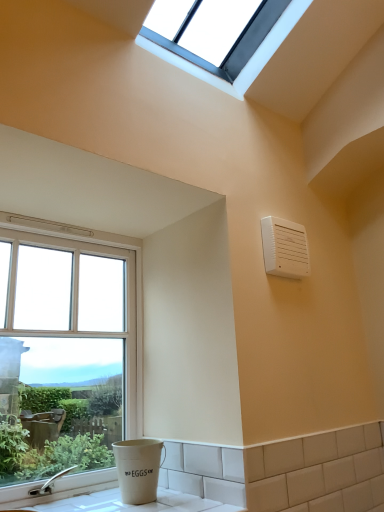
Question: Considering the relative sizes of clear glass window at left, marked as the 2th window in a top-to-bottom arrangement, and white plastic air conditioning unit at upper right in the image provided, is clear glass window at left, marked as the 2th window in a top-to-bottom arrangement, wider than white plastic air conditioning unit at upper right?

Choices:
 (A) no
 (B) yes

Answer: (B)

Question: From a real-world perspective, is clear glass window at left, marked as the 2th window in a top-to-bottom arrangement, over white plastic air conditioning unit at upper right?

Choices:
 (A) no
 (B) yes

Answer: (A)

Question: From the image's perspective, is clear glass window at left, marked as the 2th window in a top-to-bottom arrangement, under white plastic air conditioning unit at upper right?

Choices:
 (A) yes
 (B) no

Answer: (A)

Question: Is clear glass window at left, the 1th window in the left-to-right sequence, far away from white plastic air conditioning unit at upper right?

Choices:
 (A) yes
 (B) no

Answer: (B)

Question: Is white plastic air conditioning unit at upper right completely or partially inside clear glass window at left, marked as the 2th window in a top-to-bottom arrangement?

Choices:
 (A) no
 (B) yes

Answer: (A)

Question: Is clear glass window at left, placed as the first window when sorted from bottom to top, oriented towards white plastic air conditioning unit at upper right?

Choices:
 (A) yes
 (B) no

Answer: (B)

Question: Is clear glass window at upper center, the 1th window positioned from the right, located outside white ceramic counter top at lower left?

Choices:
 (A) no
 (B) yes

Answer: (B)

Question: From the image's perspective, does clear glass window at upper center, the 1th window positioned from the right, appear higher than white ceramic counter top at lower left?

Choices:
 (A) yes
 (B) no

Answer: (A)

Question: Does clear glass window at upper center, the 1th window positioned from the right, have a greater height compared to white ceramic counter top at lower left?

Choices:
 (A) yes
 (B) no

Answer: (A)

Question: Can you confirm if clear glass window at upper center, the first window positioned from the top, is positioned to the left of white ceramic counter top at lower left?

Choices:
 (A) yes
 (B) no

Answer: (B)

Question: Is clear glass window at upper center, positioned as the 2th window in left-to-right order, further to camera compared to white ceramic counter top at lower left?

Choices:
 (A) yes
 (B) no

Answer: (A)

Question: From the image's perspective, is clear glass window at upper center, positioned as the 2th window in left-to-right order, below white ceramic counter top at lower left?

Choices:
 (A) no
 (B) yes

Answer: (A)

Question: Does white plastic air conditioning unit at upper right appear on the left side of clear glass window at upper center, the 2th window in the bottom-to-top sequence?

Choices:
 (A) yes
 (B) no

Answer: (B)